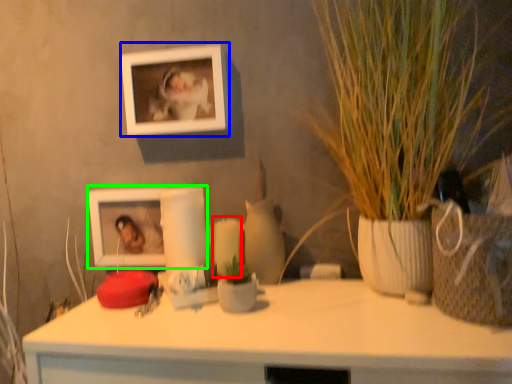
Question: Considering the real-world distances, which object is closest to candle (highlighted by a red box)? picture frame (highlighted by a blue box) or picture frame (highlighted by a green box).

Choices:
 (A) picture frame
 (B) picture frame

Answer: (B)